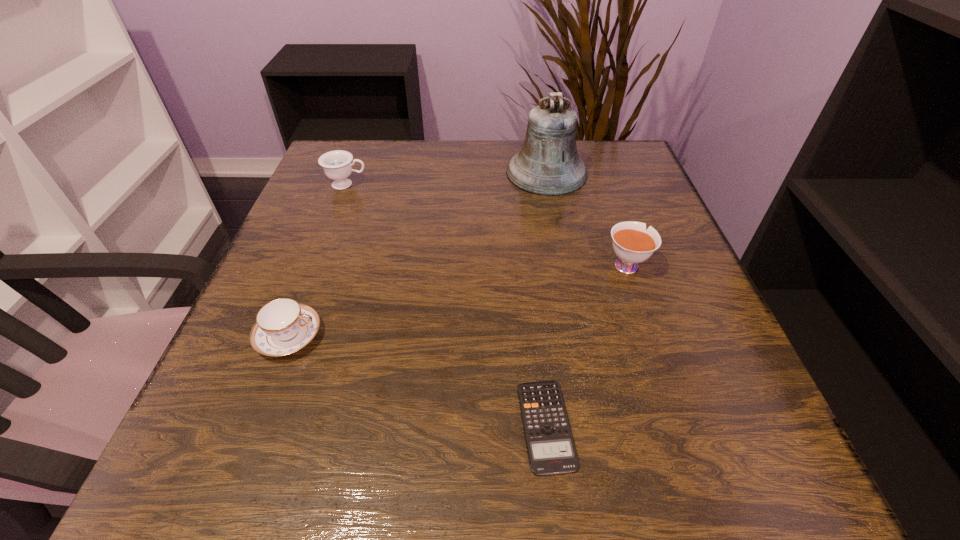
Where is `object that is positioned at the far left corner`? The height and width of the screenshot is (540, 960). object that is positioned at the far left corner is located at coordinates (337, 165).

Where is `object that is positioned at the far right corner`? Image resolution: width=960 pixels, height=540 pixels. object that is positioned at the far right corner is located at coordinates (548, 164).

In the image, there is a desktop. Where is `free space at the far edge`? This screenshot has height=540, width=960. free space at the far edge is located at coordinates (391, 180).

Identify the location of free space at the left edge of the desktop. (276, 253).

This screenshot has height=540, width=960. I want to click on vacant region at the right edge of the desktop, so click(x=675, y=278).

Find the location of a particular element. vacant space in between the second farthest teacup and the bell is located at coordinates (587, 218).

At what (x,y) coordinates should I click in order to perform the action: click on unoccupied position between the rightmost teacup and the shortest object. Please return your answer as a coordinate pair (x, y). Image resolution: width=960 pixels, height=540 pixels. Looking at the image, I should click on (586, 345).

Image resolution: width=960 pixels, height=540 pixels. Find the location of `free point between the tallest object and the nearest object`. free point between the tallest object and the nearest object is located at coordinates point(546,299).

Image resolution: width=960 pixels, height=540 pixels. Identify the location of vacant area that lies between the bell and the fourth tallest object. (418, 254).

At what (x,y) coordinates should I click in order to perform the action: click on free area in between the bell and the second farthest teacup. Please return your answer as a coordinate pair (x, y). The height and width of the screenshot is (540, 960). Looking at the image, I should click on (587, 218).